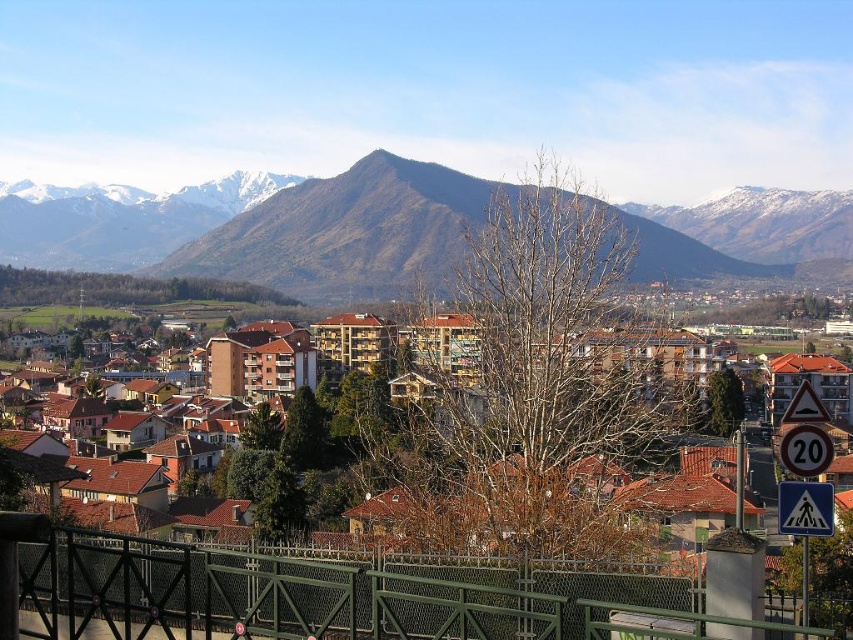
Looking at this image, you are a delivery driver approaching the town from the mountain side. You see the brown tiled roofs at center and the white plastic speed limit sign at right. Which object is closer to the mountain range?

The brown tiled roofs at center are closer to the mountain range because they are positioned to the left of the white plastic speed limit sign at right, which is further away from the mountain side.

You are a delivery drone flying over the town. You need to deliver a package to the brown tiled roofs at center. However, you notice the white plastic speed limit sign at right. Which object is taller, requiring you to adjust your flight path accordingly?

The brown tiled roofs at center is taller than the white plastic speed limit sign at right, so you should adjust your flight path to clear the brown tiled roofs at center.

You are a town planner assessing the town layout. You need to determine if the brown tiled roofs at center can be seen from the white plastic pedestrian crossing sign at lower right. Based on their widths, can you infer which is closer to the viewpoint?

The brown tiled roofs at center have a greater width than the white plastic pedestrian crossing sign at lower right. Since objects closer to the viewpoint appear wider, this suggests the brown tiled roofs at center are closer to the viewpoint than the white plastic pedestrian crossing sign at lower right.